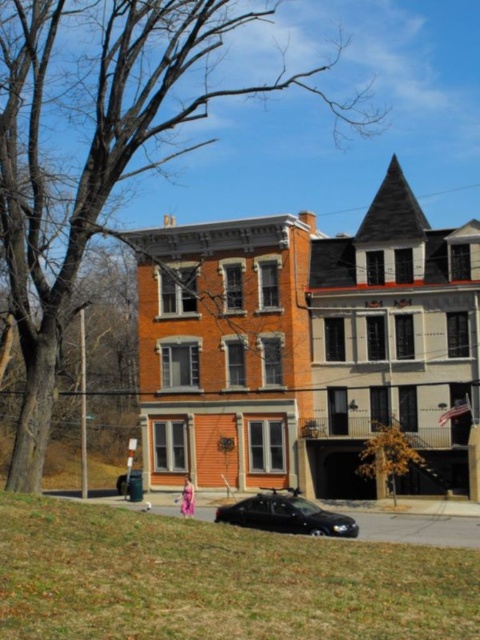
You are standing at the point marked by the coordinates point (217, 580) in the image. What is the immediate surface you are standing on?

The immediate surface at point (217, 580) is green grass at lower left.

You are standing in front of the row of residential buildings and want to take a photo. You notice two points marked in the scene. Which point, point (446, 612) or point (302, 520), is closer to your camera when capturing the image?

Point (446, 612) is closer to the camera than point (302, 520).

You are a delivery person trying to park your shiny black sedan at center near the green grass at lower left. Based on their sizes, can you estimate if there is enough space for the sedan to park next to the grass?

The green grass at lower left has a larger size compared to the shiny black sedan at center. Since the grass area is bigger, there should be sufficient space for the shiny black sedan at center to park next to it.